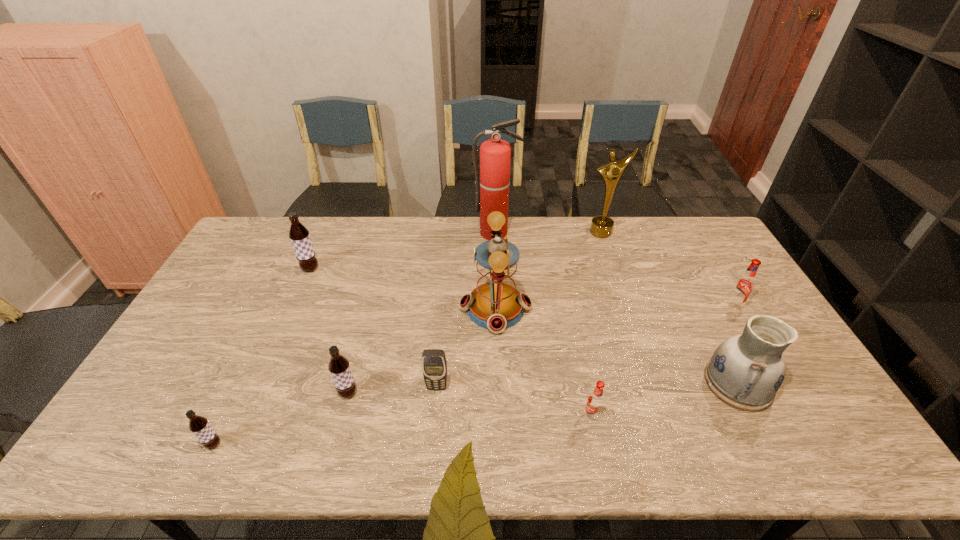
Point out which root beer is positioned as the second nearest to the biggest brown root beer. Please provide its 2D coordinates. Your answer should be formatted as a tuple, i.e. [(x, y)], where the tuple contains the x and y coordinates of a point satisfying the conditions above.

[(198, 425)]

The image size is (960, 540). In order to click on root beer that is the third closest one to the nearest brown root beer in this screenshot , I will do point(595,401).

Locate an element on the screen. The width and height of the screenshot is (960, 540). brown root beer that is the third closest to the second farthest root beer is located at coordinates point(198,425).

Identify which brown root beer is located as the nearest to the pottery. Please provide its 2D coordinates. Your answer should be formatted as a tuple, i.e. [(x, y)], where the tuple contains the x and y coordinates of a point satisfying the conditions above.

[(339, 367)]

Locate an element on the screen. The width and height of the screenshot is (960, 540). free location that satisfies the following two spatial constraints: 1. on the front-facing side of the third tallest object; 2. on the left side of the fourth farthest root beer is located at coordinates (499, 416).

You are a GUI agent. You are given a task and a screenshot of the screen. Output one action in this format:
    pyautogui.click(x=<x>, y=<y>)
    Task: Click on the vacant space that satisfies the following two spatial constraints: 1. on the front face of the fourth object from right to left; 2. on the right side of the seventh object from right to left
    
    Given the screenshot: What is the action you would take?
    pyautogui.click(x=434, y=416)

In order to click on free space that satisfies the following two spatial constraints: 1. on the back side of the bigger red root beer; 2. on the left side of the blue pottery in this screenshot , I will do `click(698, 305)`.